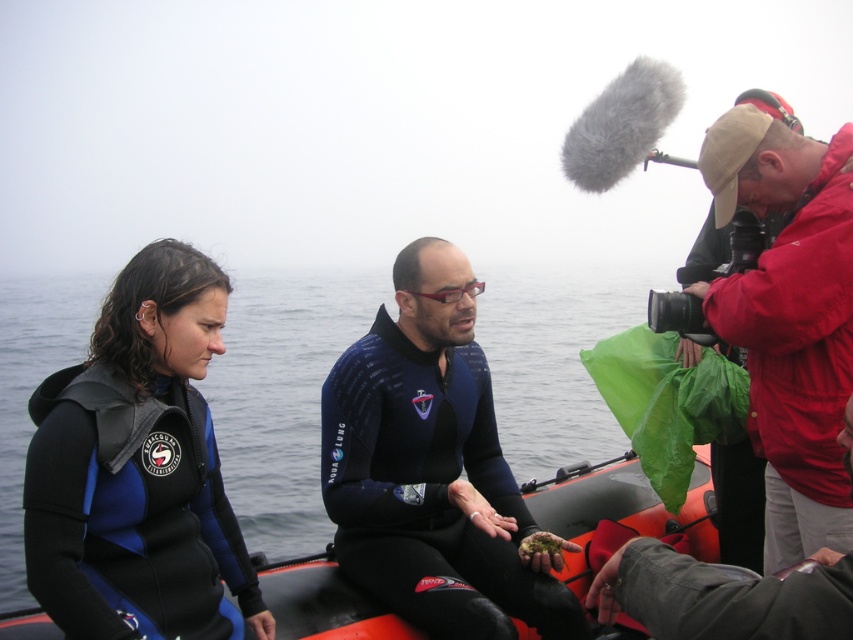
Question: Does blue neoprene wetsuit at center come in front of red matte jacket at upper right?

Choices:
 (A) no
 (B) yes

Answer: (A)

Question: Which object is positioned closest to the blue neoprene wetsuit at center?

Choices:
 (A) red matte jacket at upper right
 (B) red jacket at upper right
 (C) rubber boat at center

Answer: (C)

Question: Which of the following is the closest to the observer?

Choices:
 (A) (167, 433)
 (B) (627, 541)
 (C) (820, 323)
 (D) (685, 531)

Answer: (B)

Question: Which object is the farthest from the red matte jacket at upper right?

Choices:
 (A) rubber boat at center
 (B) red jacket at upper right

Answer: (A)

Question: Can you confirm if blue matte wetsuit at left is positioned to the left of red matte jacket at upper right?

Choices:
 (A) yes
 (B) no

Answer: (A)

Question: Where is red jacket at upper right located in relation to red matte jacket at upper right in the image?

Choices:
 (A) above
 (B) below

Answer: (A)